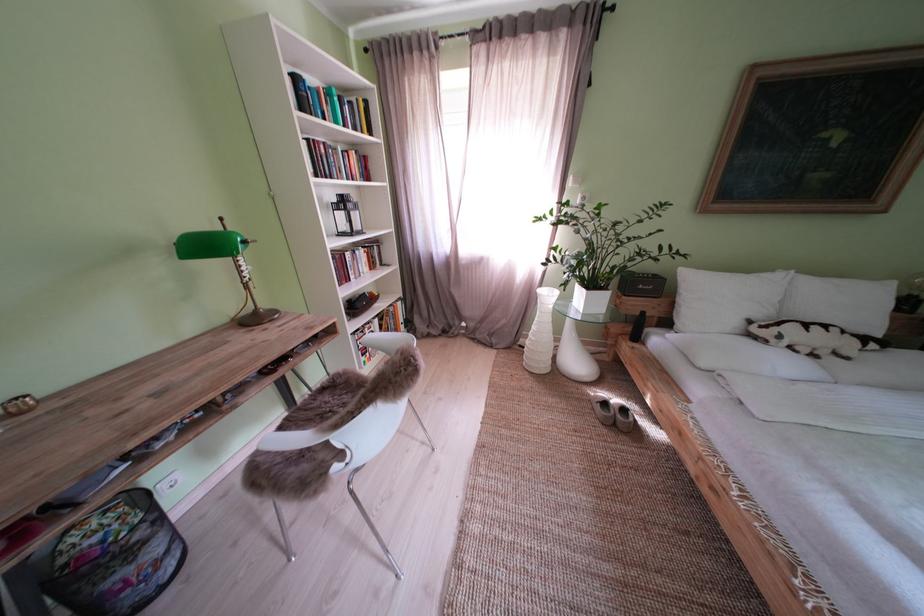
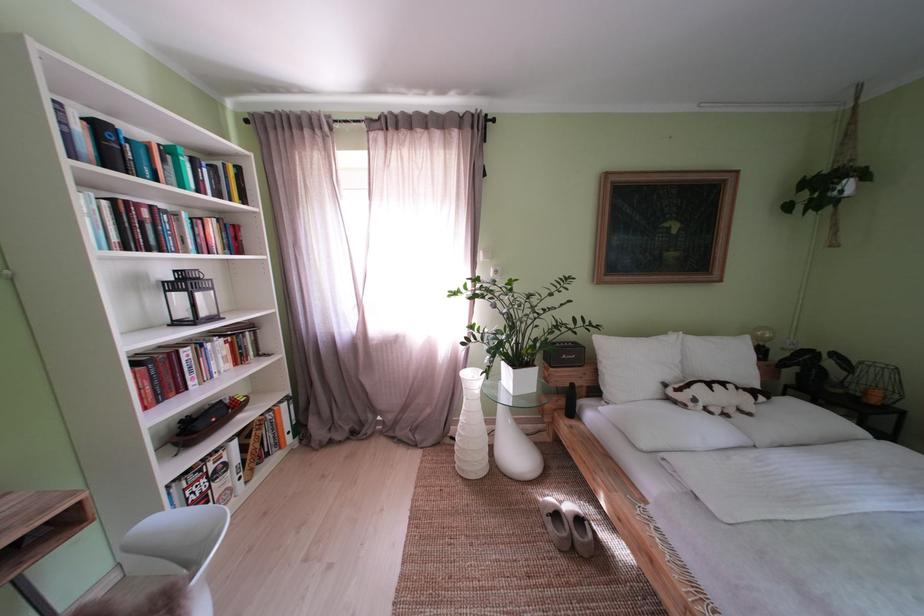
In the second image, find the point that corresponds to pixel 616 408 in the first image.

(567, 521)